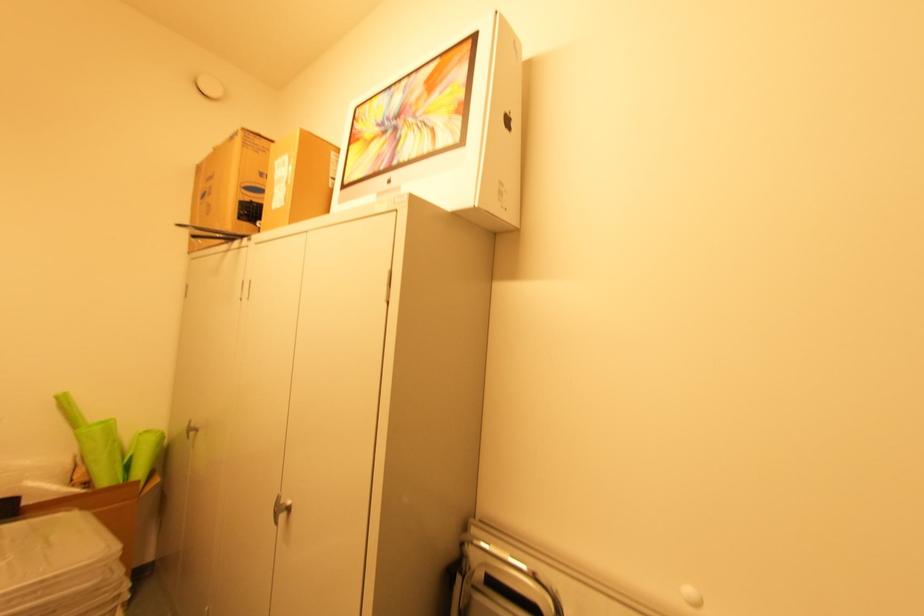
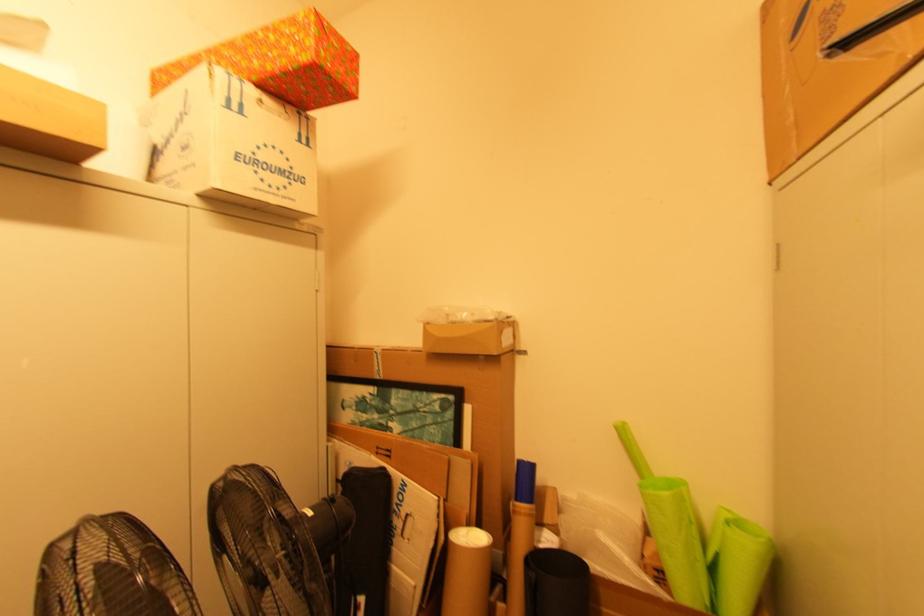
Find the pixel in the second image that matches [141,474] in the first image.

(736, 605)